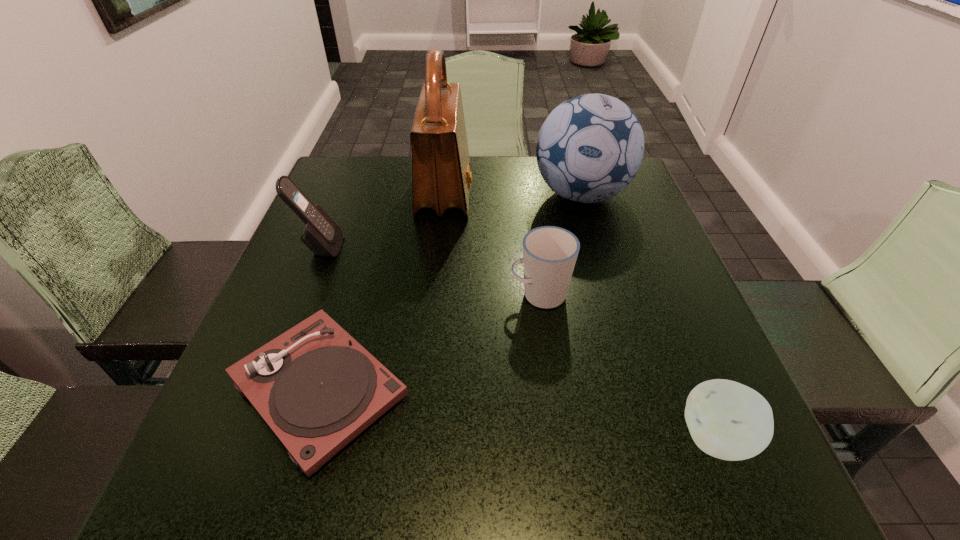
Locate an element on the screen. This screenshot has width=960, height=540. cellular telephone at the left edge is located at coordinates (321, 235).

The height and width of the screenshot is (540, 960). In order to click on phonograph_record that is positioned at the left edge in this screenshot , I will do `click(317, 388)`.

The image size is (960, 540). I want to click on soccer ball that is at the right edge, so click(x=590, y=147).

I want to click on apple located in the right edge section of the desktop, so click(x=727, y=420).

This screenshot has width=960, height=540. I want to click on object present at the near left corner, so click(317, 388).

Where is `object present at the far right corner`? This screenshot has width=960, height=540. object present at the far right corner is located at coordinates (590, 147).

Where is `object that is at the near right corner`? This screenshot has height=540, width=960. object that is at the near right corner is located at coordinates (727, 420).

The height and width of the screenshot is (540, 960). I want to click on free spot at the far edge of the desktop, so click(x=410, y=187).

Locate an element on the screen. vacant region at the near edge of the desktop is located at coordinates (570, 471).

This screenshot has width=960, height=540. Identify the location of free location at the left edge. (256, 426).